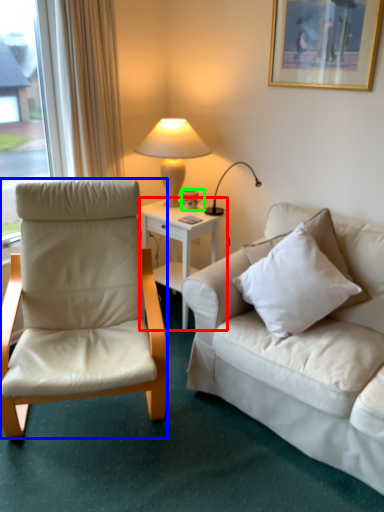
Question: Which is nearer to the desk (highlighted by a red box)? chair (highlighted by a blue box) or coffee cup (highlighted by a green box).

Choices:
 (A) chair
 (B) coffee cup

Answer: (B)